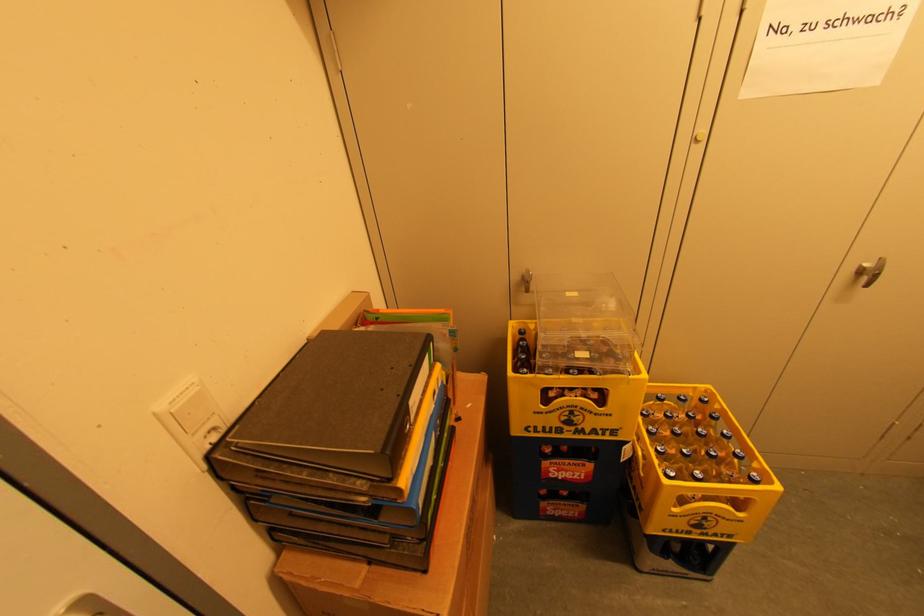
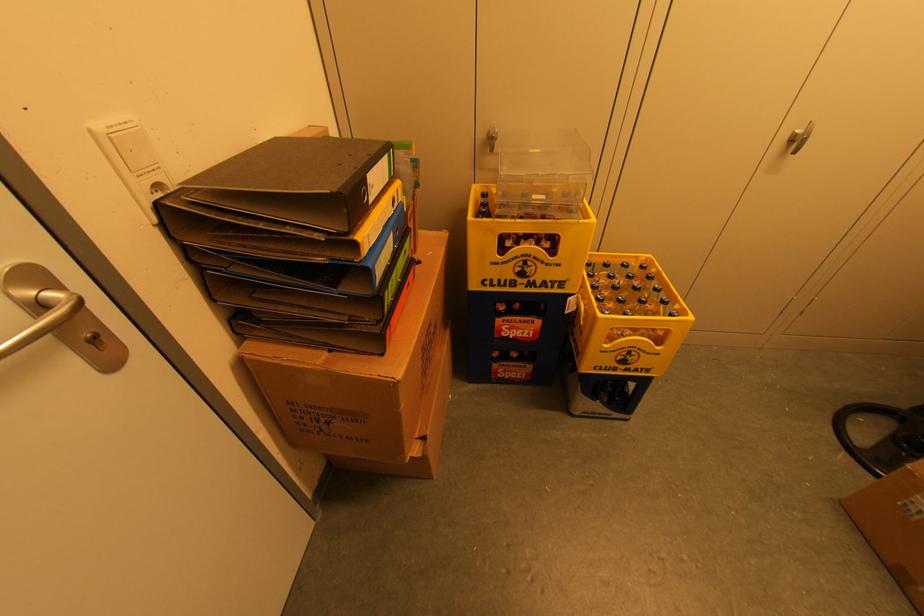
In the second image, find the point that corresponds to point (533, 370) in the first image.

(492, 215)